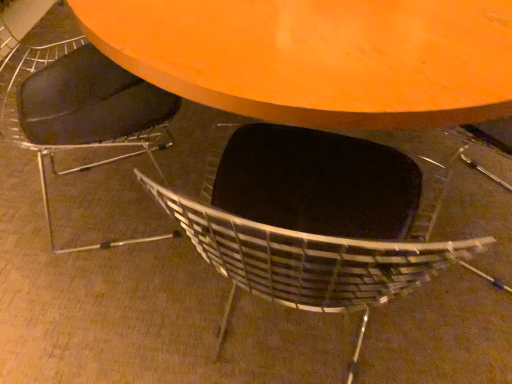
Locate an element on the screen. The height and width of the screenshot is (384, 512). vacant area situated below black leather chair at center, which is counted as the second chair, starting from the left (from a real-world perspective) is located at coordinates (285, 336).